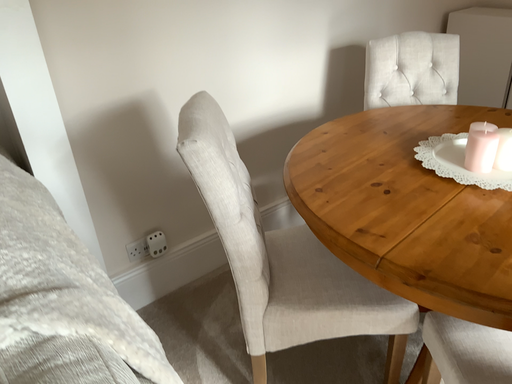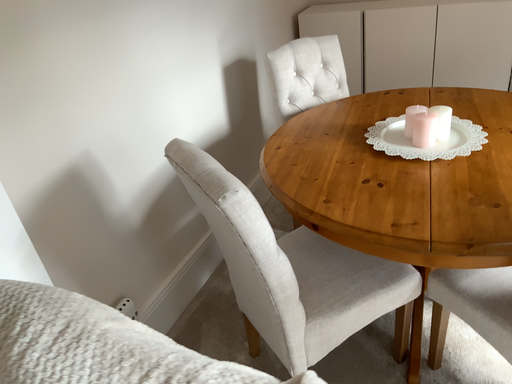
Question: Which way did the camera rotate in the video?

Choices:
 (A) rotated left
 (B) rotated right

Answer: (B)